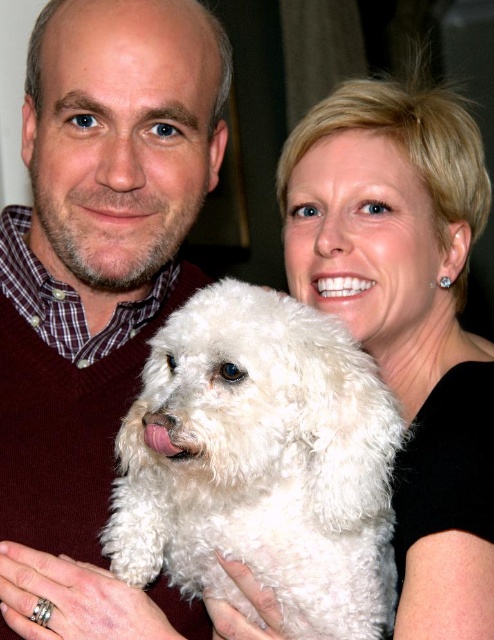
Can you confirm if matte maroon sweater at left is positioned above white fluffy dog at center?

Indeed, matte maroon sweater at left is positioned over white fluffy dog at center.

Is matte maroon sweater at left to the right of white fluffy dog at center from the viewer's perspective?

In fact, matte maroon sweater at left is to the left of white fluffy dog at center.

Measure the distance between point (90, 541) and camera.

Point (90, 541) and camera are 37.69 inches apart.

You are a GUI agent. You are given a task and a screenshot of the screen. Output one action in this format:
    pyautogui.click(x=<x>, y=<y>)
    Task: Click on the matte maroon sweater at left
    
    Given the screenshot: What is the action you would take?
    pyautogui.click(x=95, y=252)

Identify the location of white fluffy dog at center. (260, 464).

Between point (197, 522) and point (423, 301), which one is positioned in front?

Positioned in front is point (197, 522).

Locate an element on the screen. The height and width of the screenshot is (640, 494). white fluffy dog at center is located at coordinates (260, 464).

I want to click on matte maroon sweater at left, so click(95, 252).

Which is more to the left, matte maroon sweater at left or white fluffy dog at upper center?

From the viewer's perspective, matte maroon sweater at left appears more on the left side.

Where is `matte maroon sweater at left`? The image size is (494, 640). matte maroon sweater at left is located at coordinates (95, 252).

This screenshot has height=640, width=494. Identify the location of matte maroon sweater at left. (95, 252).